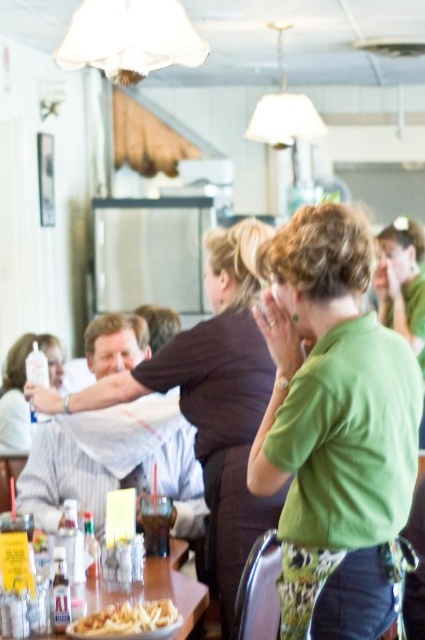
You are a customer sitting at the wooden table at lower left. You want to grab the golden crispy fries at lower left. Can you easily reach them from your current position?

The golden crispy fries at lower left are behind the wooden table at lower left, so they are not within easy reach from your seated position at the table.

You are a customer at the restaurant and want to grab the golden crispy fries at lower left. However, there is a matte white bottle at left in the way. Can you reach the fries without moving the bottle?

The matte white bottle at left is located above the golden crispy fries at lower left, so you can reach the fries without moving the bottle since it is positioned below the bottle.

You are a restaurant manager checking the layout. You need to place a new menu board between the green matte shirt at center and the matte brown shirt at center. Since the menu board is 10 cm thick, will it fit between them?

The green matte shirt at center is thinner than the matte brown shirt at center. However, the description only provides information about their thickness, not the distance between them. Therefore, it is impossible to determine if the menu board will fit based on the given information.